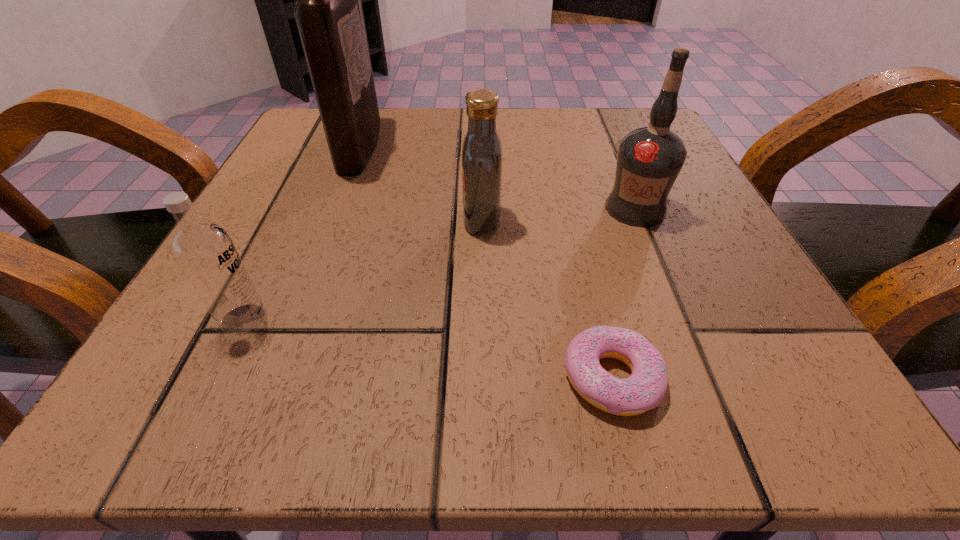
The height and width of the screenshot is (540, 960). In order to click on the tallest object in this screenshot , I will do `click(328, 11)`.

The height and width of the screenshot is (540, 960). In order to click on liquor in this screenshot , I will do `click(328, 11)`.

The image size is (960, 540). What are the coordinates of `the rightmost object` in the screenshot? It's located at (649, 159).

This screenshot has width=960, height=540. What are the coordinates of `the second tallest object` in the screenshot? It's located at 649,159.

At what (x,y) coordinates should I click in order to perform the action: click on the third object from right to left. Please return your answer as a coordinate pair (x, y). The image size is (960, 540). Looking at the image, I should click on (482, 156).

Where is `the nearest vodka`? The width and height of the screenshot is (960, 540). the nearest vodka is located at coordinates (205, 252).

Locate an element on the screen. This screenshot has width=960, height=540. the fourth farthest object is located at coordinates (205, 252).

Where is `the nearest object`? The width and height of the screenshot is (960, 540). the nearest object is located at coordinates (645, 388).

Find the location of a particular element. This screenshot has height=540, width=960. the fourth object from left to right is located at coordinates (645, 388).

You are a GUI agent. You are given a task and a screenshot of the screen. Output one action in this format:
    pyautogui.click(x=<x>, y=<y>)
    Task: Click on the vacant region located 0.180m on the label side of the farthest object
    This screenshot has height=540, width=960.
    Given the screenshot: What is the action you would take?
    pyautogui.click(x=473, y=146)